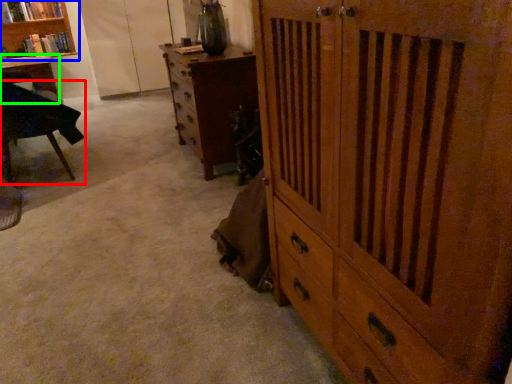
Question: Estimate the real-world distances between objects in this image. Which object is farther from chair (highlighted by a red box), bookcase (highlighted by a blue box) or desk (highlighted by a green box)?

Choices:
 (A) bookcase
 (B) desk

Answer: (A)